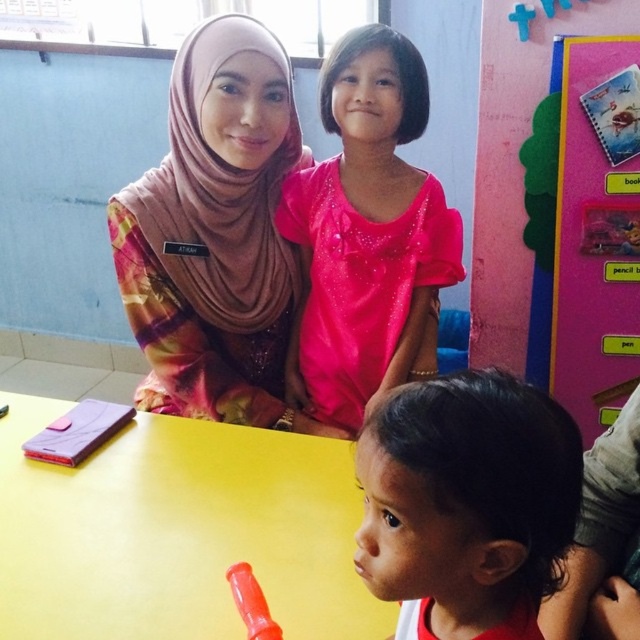
Does yellow matte table at center appear over multicolored fabric hijab at upper left?

Incorrect, yellow matte table at center is not positioned above multicolored fabric hijab at upper left.

Who is taller, yellow matte table at center or multicolored fabric hijab at upper left?

With more height is multicolored fabric hijab at upper left.

What do you see at coordinates (179, 532) in the screenshot?
I see `yellow matte table at center` at bounding box center [179, 532].

The height and width of the screenshot is (640, 640). I want to click on yellow matte table at center, so click(179, 532).

Can you confirm if pink sparkly dress at center is taller than rubberized plastic toy at lower center?

Indeed, pink sparkly dress at center has a greater height compared to rubberized plastic toy at lower center.

This screenshot has height=640, width=640. What do you see at coordinates (369, 228) in the screenshot?
I see `pink sparkly dress at center` at bounding box center [369, 228].

Find the location of a particular element. pink sparkly dress at center is located at coordinates [369, 228].

Is multicolored fabric hijab at upper left bigger than dark brown hair at lower right?

Indeed, multicolored fabric hijab at upper left has a larger size compared to dark brown hair at lower right.

Which is behind, point (173, 80) or point (566, 529)?

Point (173, 80)

Locate an element on the screen. multicolored fabric hijab at upper left is located at coordinates (214, 232).